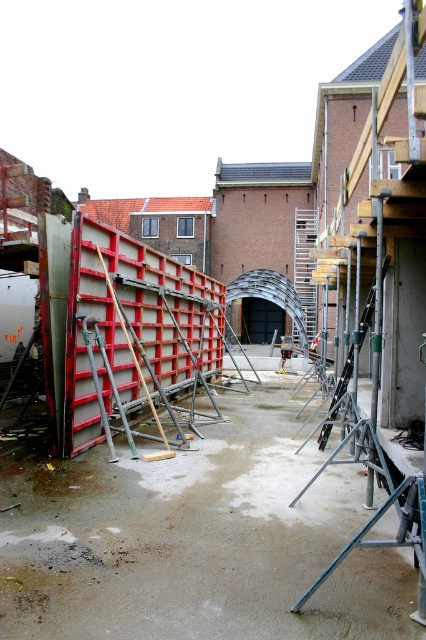
Question: Does metallic gray barrier at center have a larger size compared to metallic silver ladder at center?

Choices:
 (A) no
 (B) yes

Answer: (A)

Question: Does metallic gray barrier at center appear on the right side of metallic silver ladder at center?

Choices:
 (A) yes
 (B) no

Answer: (B)

Question: Is metallic gray barrier at center below metallic silver ladder at center?

Choices:
 (A) yes
 (B) no

Answer: (A)

Question: Which point is closer to the camera taking this photo?

Choices:
 (A) [x=310, y=244]
 (B) [x=195, y=296]

Answer: (B)

Question: Which object is closer to the camera taking this photo?

Choices:
 (A) metallic gray barrier at center
 (B) metallic silver ladder at center

Answer: (A)

Question: Which of the following is the farthest from the observer?

Choices:
 (A) (91, 240)
 (B) (314, 300)

Answer: (B)